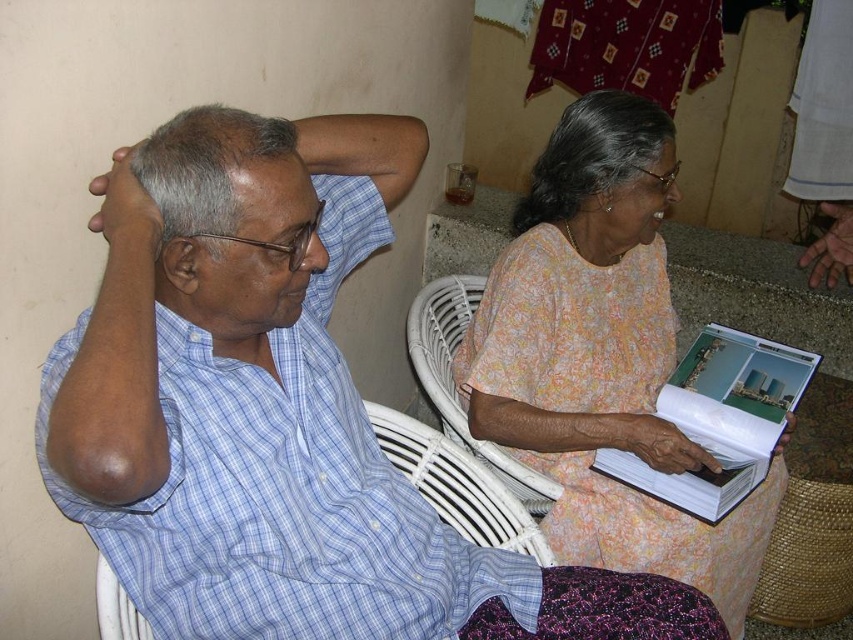
Is point (335, 589) closer to viewer compared to point (239, 211)?

That is False.

Where is `blue plaid shirt at left`? The image size is (853, 640). blue plaid shirt at left is located at coordinates (277, 419).

Does point (373, 470) lie behind point (618, 177)?

No.

Between point (508, 577) and point (628, 141), which one is positioned in front?

Point (508, 577)

At what (x,y) coordinates should I click in order to perform the action: click on blue plaid shirt at left. Please return your answer as a coordinate pair (x, y). Looking at the image, I should click on (277, 419).

Does matte blue shirt at left lie behind matte blue shirt at upper left?

No, it is in front of matte blue shirt at upper left.

Is point (170, 291) less distant than point (265, 204)?

No, it is not.

Between point (202, 301) and point (248, 173), which one is positioned behind?

The point (202, 301) is more distant.

In order to click on matte blue shirt at left in this screenshot , I will do `click(230, 218)`.